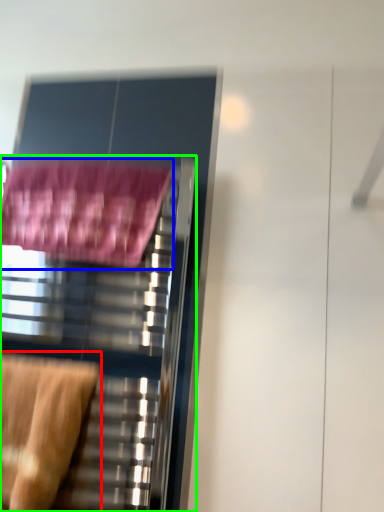
Question: Which object is positioned closest to swivel chair (highlighted by a red box)? Select from bath towel (highlighted by a blue box) and furniture (highlighted by a green box).

Choices:
 (A) bath towel
 (B) furniture

Answer: (B)